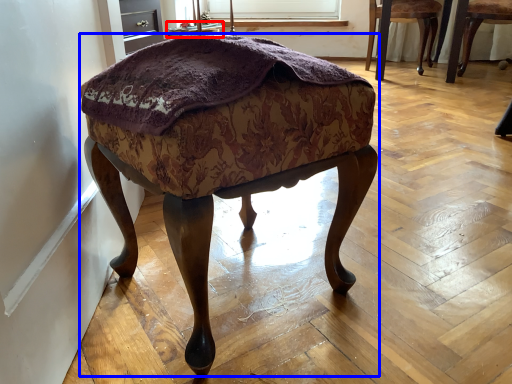
Question: Among these objects, which one is farthest to the camera, side table (highlighted by a red box) or stool (highlighted by a blue box)?

Choices:
 (A) side table
 (B) stool

Answer: (A)